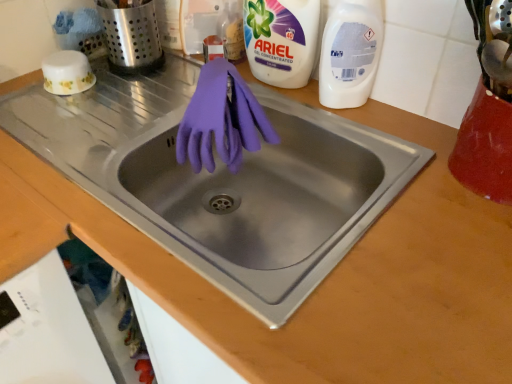
The image size is (512, 384). I want to click on vacant area in front of white gel concentrated at upper right, which ranks as the first cleaning product in left-to-right order, so click(303, 112).